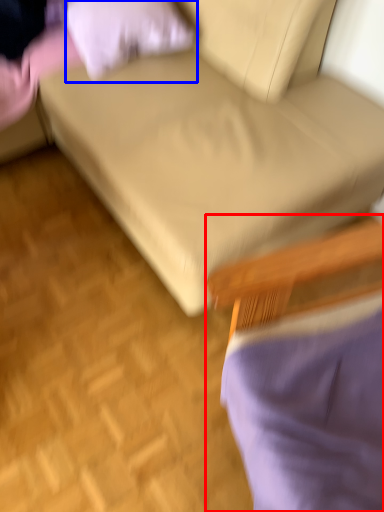
Question: Which object appears farthest to the camera in this image, chair (highlighted by a red box) or pillow (highlighted by a blue box)?

Choices:
 (A) chair
 (B) pillow

Answer: (B)